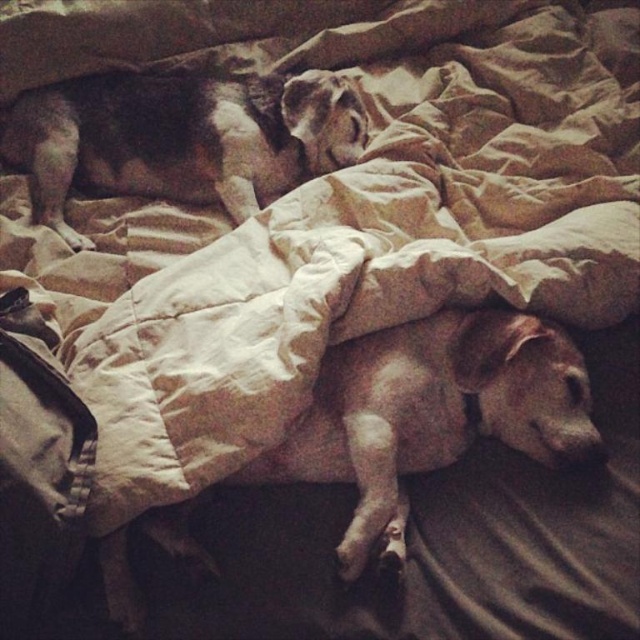
Question: Which object appears farthest from the camera in this image?

Choices:
 (A) white smooth dog at lower right
 (B) brown fur dog at upper left

Answer: (B)

Question: Does white smooth dog at lower right appear on the right side of brown fur dog at upper left?

Choices:
 (A) no
 (B) yes

Answer: (B)

Question: From the image, what is the correct spatial relationship of white smooth dog at lower right in relation to brown fur dog at upper left?

Choices:
 (A) above
 (B) below

Answer: (B)

Question: Does white smooth dog at lower right appear on the left side of brown fur dog at upper left?

Choices:
 (A) yes
 (B) no

Answer: (B)